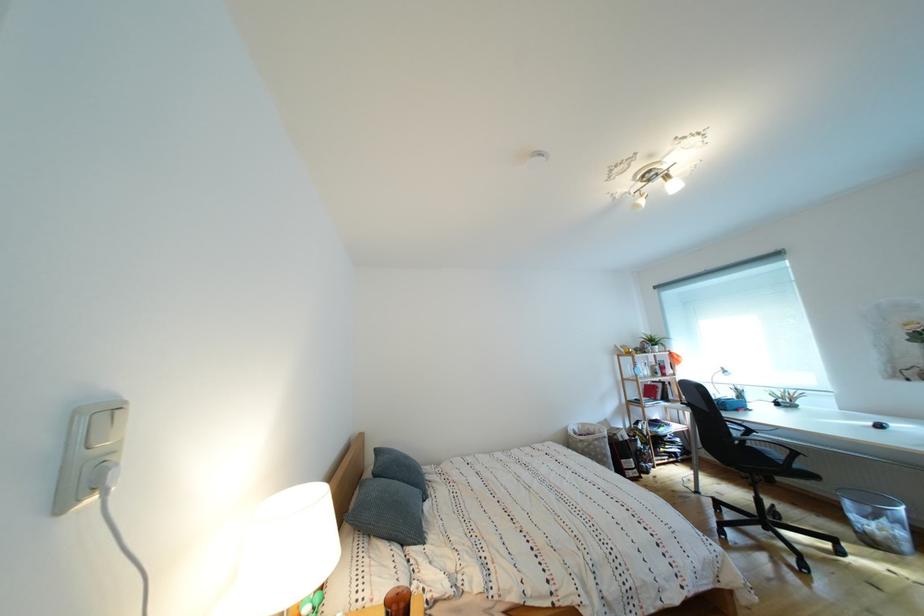
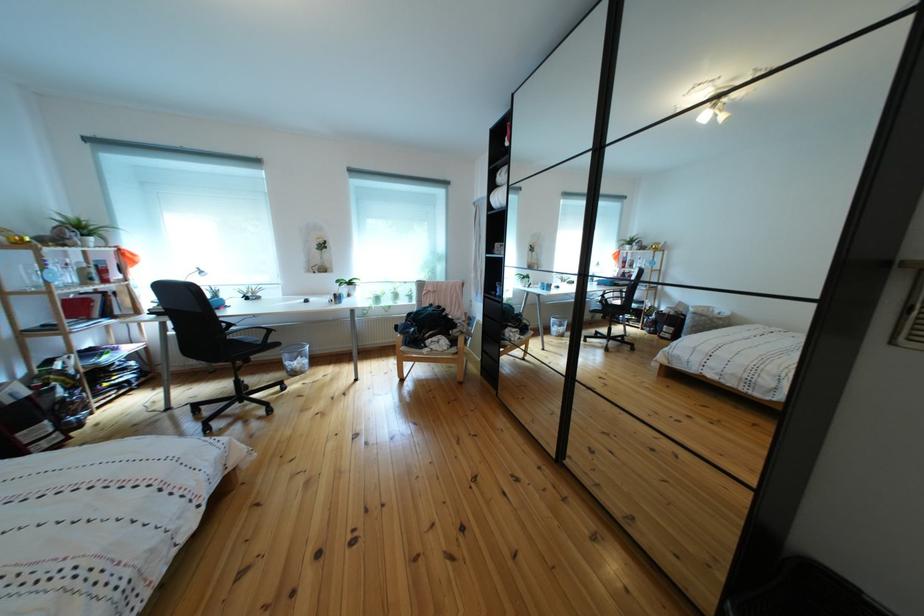
Question: The camera is either moving clockwise (left) or counter-clockwise (right) around the object. The first image is from the beginning of the video and the second image is from the end. Is the camera moving left or right when shooting the video?

Choices:
 (A) Left
 (B) Right

Answer: (A)